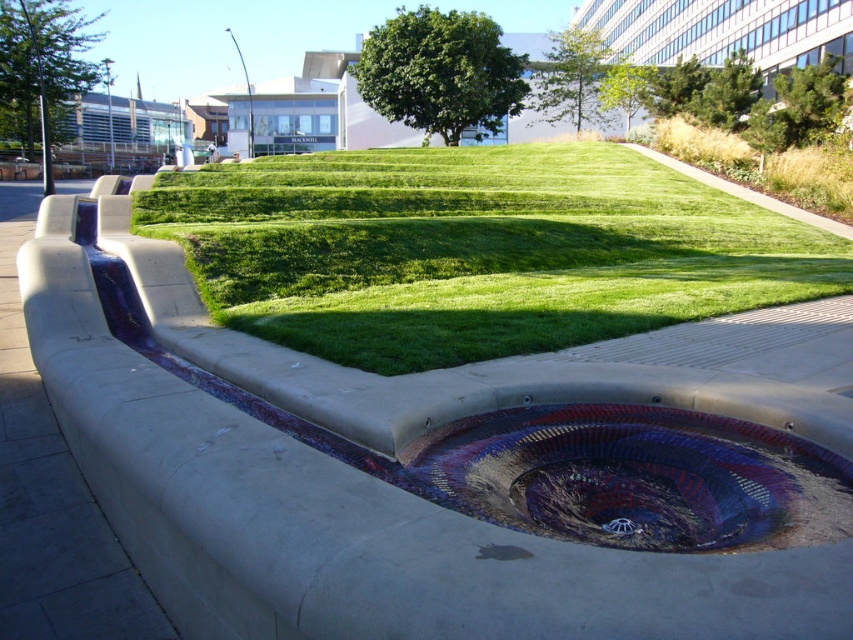
You are designing a small garden and have both the concrete at center and the multicolored mosaic sink at center. Which object takes up more space in the garden?

The multicolored mosaic sink at center occupies more space than the concrete at center.

You are a gardener planning to place a new flower pot between the concrete at center and the multicolored mosaic sink at center. Based on their positions, which object should the flower pot be closer to?

The flower pot should be placed closer to the multicolored mosaic sink at center because the concrete at center is to the left of the multicolored mosaic sink at center, meaning the sink is positioned to the right of the concrete. Therefore, placing the flower pot between them would require it to be closer to the sink if it is to the right of the concrete.

In the scene shown: What is the exact coordinate of the concrete at center?

The concrete at center is located at coordinate point [448,465].